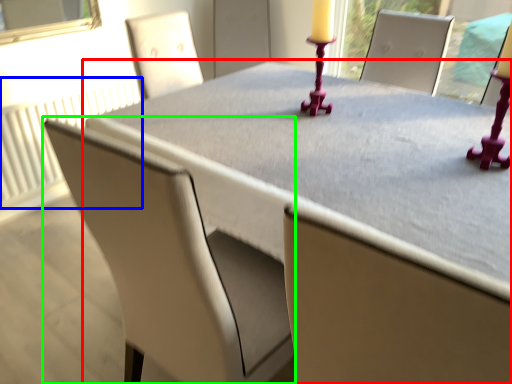
Question: Based on their relative distances, which object is farther from table (highlighted by a red box)? Choose from radiator (highlighted by a blue box) and chair (highlighted by a green box).

Choices:
 (A) radiator
 (B) chair

Answer: (A)